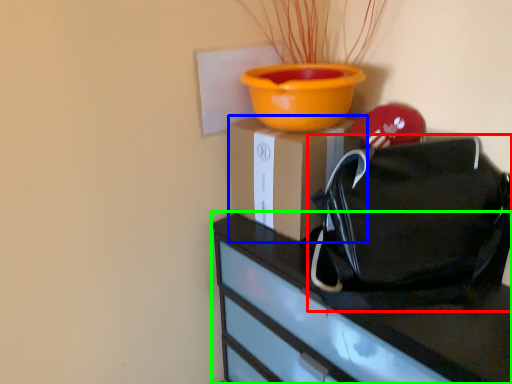
Question: Based on their relative distances, which object is farther from handbag (highlighted by a red box)? Choose from cardboard box (highlighted by a blue box) and furniture (highlighted by a green box).

Choices:
 (A) cardboard box
 (B) furniture

Answer: (A)